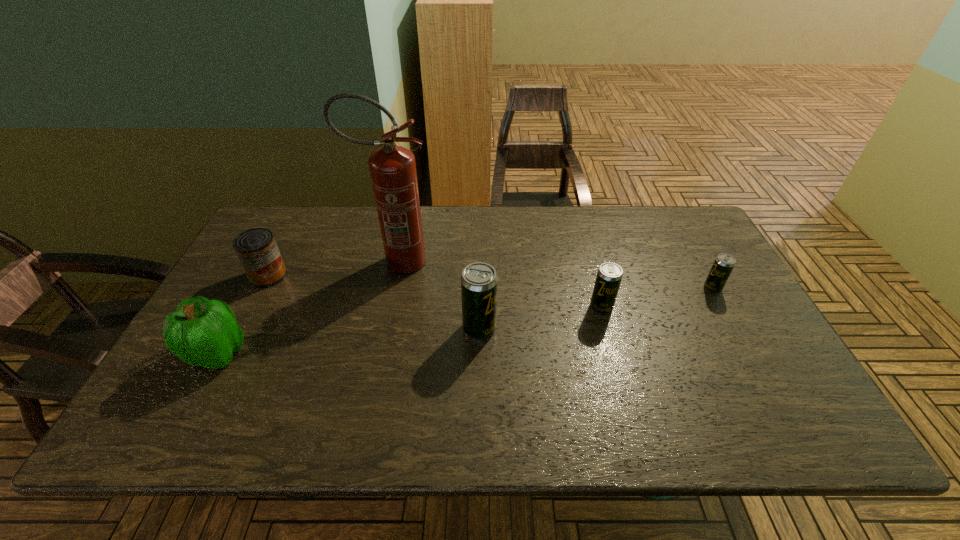
You are a GUI agent. You are given a task and a screenshot of the screen. Output one action in this format:
    pyautogui.click(x=<x>, y=<y>)
    Task: Click on the leftmost beer can
    
    Given the screenshot: What is the action you would take?
    pyautogui.click(x=479, y=282)

Identify the location of the tallest beer can. This screenshot has width=960, height=540. (479, 282).

Locate an element on the screen. The image size is (960, 540). the second shortest beer can is located at coordinates (609, 275).

Locate an element on the screen. This screenshot has height=540, width=960. the second nearest beer can is located at coordinates [x=609, y=275].

I want to click on the farthest beer can, so click(x=723, y=265).

Where is `the rightmost beer can`? The height and width of the screenshot is (540, 960). the rightmost beer can is located at coordinates (723, 265).

Where is `can`? This screenshot has width=960, height=540. can is located at coordinates (256, 248).

Image resolution: width=960 pixels, height=540 pixels. What are the coordinates of `fire extinguisher` in the screenshot? It's located at (392, 168).

The image size is (960, 540). What are the coordinates of `the tallest object` in the screenshot? It's located at (392, 168).

Image resolution: width=960 pixels, height=540 pixels. Find the location of `bell pepper`. bell pepper is located at coordinates (202, 332).